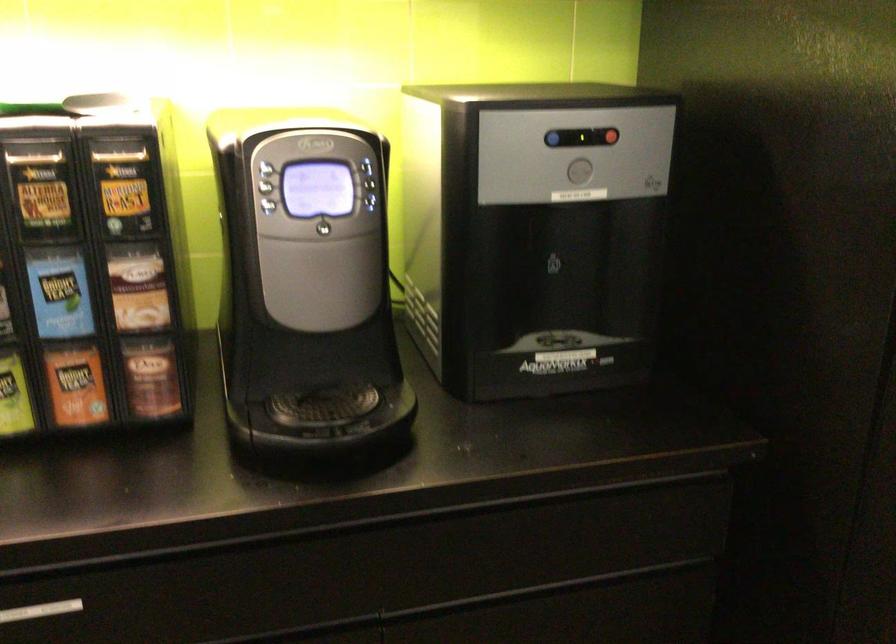
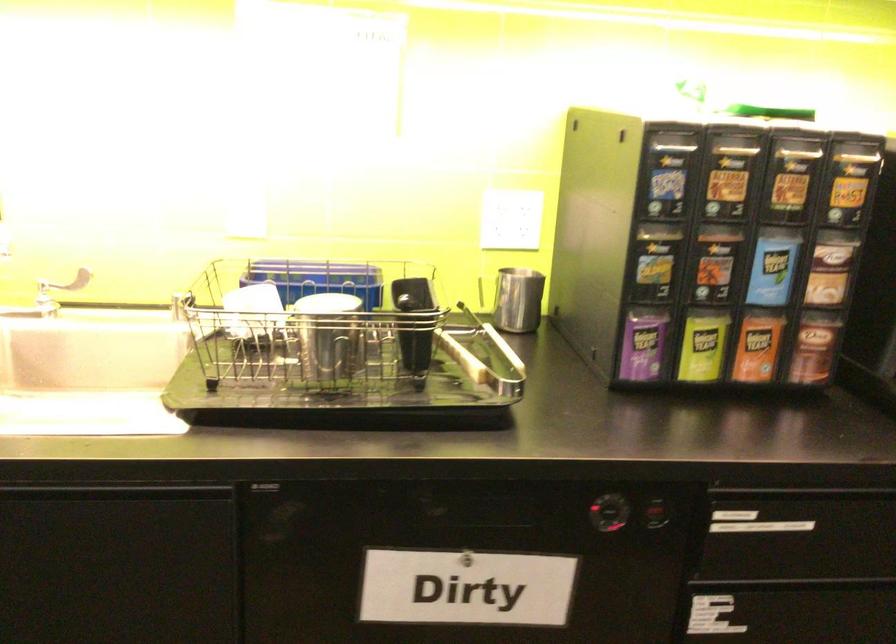
Question: The first image is from the beginning of the video and the second image is from the end. How did the camera likely rotate when shooting the video?

Choices:
 (A) Left
 (B) Right
 (C) Up
 (D) Down

Answer: (A)